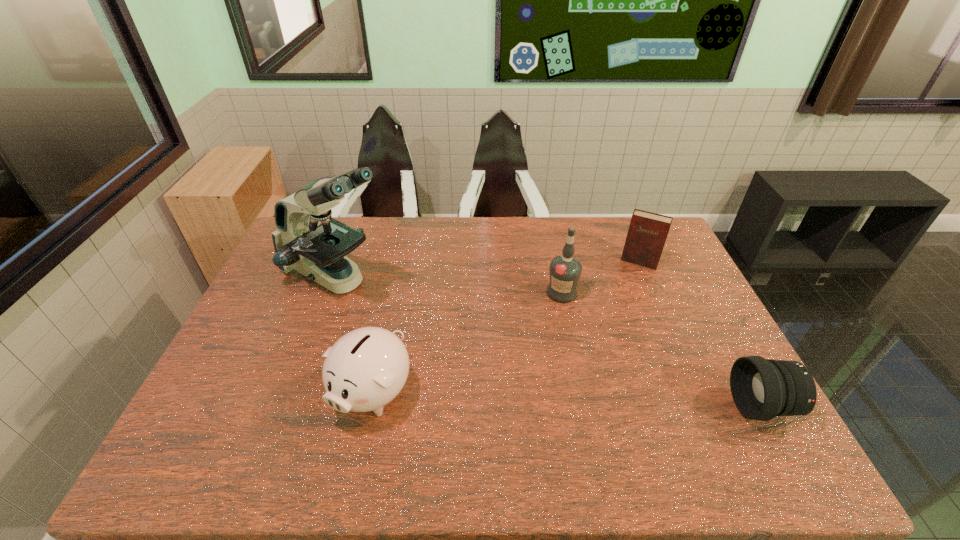
Locate an element on the screen. piggy bank is located at coordinates pos(365,369).

Where is `telephoto lens`? This screenshot has width=960, height=540. telephoto lens is located at coordinates (761, 388).

Locate an element on the screen. This screenshot has height=540, width=960. the rightmost object is located at coordinates 761,388.

The width and height of the screenshot is (960, 540). I want to click on vodka, so pyautogui.click(x=565, y=270).

The image size is (960, 540). What are the coordinates of `the fourth shortest object` in the screenshot? It's located at (565, 270).

You are a GUI agent. You are given a task and a screenshot of the screen. Output one action in this format:
    pyautogui.click(x=<x>, y=<y>)
    Task: Click on the diary
    This screenshot has height=540, width=960.
    Given the screenshot: What is the action you would take?
    pyautogui.click(x=647, y=233)

Find the location of a particular element. the tallest object is located at coordinates (307, 239).

In order to click on free spot located 0.230m on the right of the piggy bank in this screenshot , I will do point(505,393).

Locate an element on the screen. This screenshot has height=540, width=960. vacant space located at the front element of the rightmost object is located at coordinates point(612,406).

Find the location of a particular element. free space located 0.220m at the front element of the rightmost object is located at coordinates [x=644, y=406].